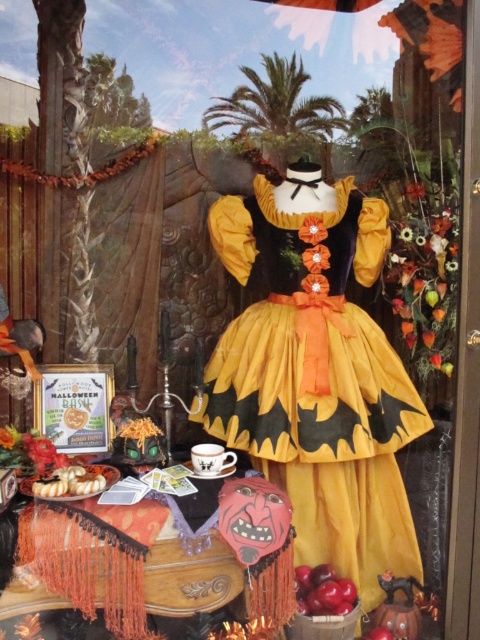
Question: Can you confirm if matte yellow fabric dress at center is positioned above shiny red apples at lower center?

Choices:
 (A) no
 (B) yes

Answer: (B)

Question: Which is farther from the matte yellow fabric dress at center?

Choices:
 (A) shiny red apples at lower center
 (B) white fluffy pastry at lower left

Answer: (B)

Question: Which is nearer to the shiny red apples at lower center?

Choices:
 (A) matte yellow fabric dress at center
 (B) white fluffy pastry at lower left

Answer: (A)

Question: Considering the real-world distances, which object is closest to the white fluffy pastry at lower left?

Choices:
 (A) matte yellow fabric dress at center
 (B) shiny red apples at lower center

Answer: (A)

Question: In this image, where is matte yellow fabric dress at center located relative to shiny red apples at lower center?

Choices:
 (A) left
 (B) right

Answer: (A)

Question: Is matte yellow fabric dress at center to the right of shiny red apples at lower center from the viewer's perspective?

Choices:
 (A) no
 (B) yes

Answer: (A)